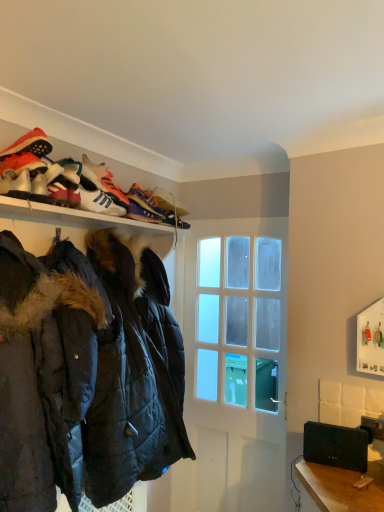
Question: Visually, is white leather sneakers at upper center, which appears as the third footwear when viewed from the front, positioned to the left or to the right of matte black shoes at upper center, which is counted as the first footwear, starting from the back?

Choices:
 (A) left
 (B) right

Answer: (A)

Question: From the image's perspective, relative to matte black shoes at upper center, positioned as the 4th footwear in front-to-back order, is white leather sneakers at upper center, placed as the second footwear when sorted from back to front, above or below?

Choices:
 (A) above
 (B) below

Answer: (A)

Question: Based on their relative distances, which object is farther from the white leather sneakers at upper center, marked as the 2th shoe in a back-to-front arrangement?

Choices:
 (A) clear glass door at center
 (B) matte black shoes at upper center, which is counted as the first footwear, starting from the back
 (C) white leather sneakers at upper left, arranged as the 1th footwear when viewed from the front
 (D) dark blue quilted jacket at left
 (E) white matte shoe rack at upper left

Answer: (A)

Question: Estimate the real-world distances between objects in this image. Which object is farther from the multicolored fabric shoe at upper center, which ranks as the first shoe in back-to-front order?

Choices:
 (A) dark blue quilted jacket at left
 (B) matte black shoes at upper center, positioned as the 4th footwear in front-to-back order
 (C) white matte shoe rack at upper left
 (D) white leather sneakers at upper center, placed as the second footwear when sorted from back to front
 (E) red suede sneaker at upper left, which is counted as the third footwear, starting from the back

Answer: (A)